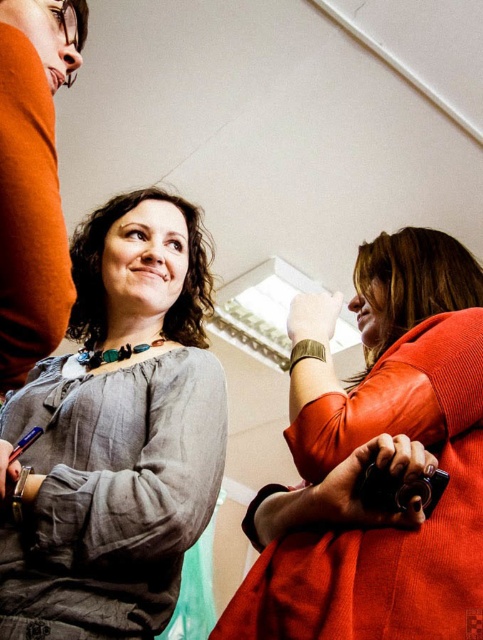
Can you confirm if matte gray blouse at center is smaller than matte orange sweater at left?

No.

Is matte gray blouse at center above matte orange sweater at left?

Incorrect, matte gray blouse at center is not positioned above matte orange sweater at left.

Is point (174, 529) positioned behind point (32, 353)?

Yes, it is behind point (32, 353).

Find the location of a particular element. This screenshot has height=640, width=483. matte gray blouse at center is located at coordinates (117, 433).

Which of these two, matte gray blouse at center or matte orange sweater at right, stands taller?

matte gray blouse at center is taller.

Does point (80, 497) come farther from viewer compared to point (411, 291)?

No.

Who is more distant from viewer, (101, 262) or (255, 582)?

The point (101, 262) is behind.

Locate an element on the screen. matte gray blouse at center is located at coordinates (117, 433).

In order to click on matte orange sweater at right in this screenshot , I will do `click(371, 438)`.

Does matte orange sweater at right have a lesser width compared to matte orange sweater at left?

Incorrect, matte orange sweater at right's width is not less than matte orange sweater at left's.

The height and width of the screenshot is (640, 483). Describe the element at coordinates (371, 438) in the screenshot. I see `matte orange sweater at right` at that location.

You are a GUI agent. You are given a task and a screenshot of the screen. Output one action in this format:
    pyautogui.click(x=<x>, y=<y>)
    Task: Click on the matte orange sweater at right
    The width and height of the screenshot is (483, 640).
    Given the screenshot: What is the action you would take?
    pyautogui.click(x=371, y=438)